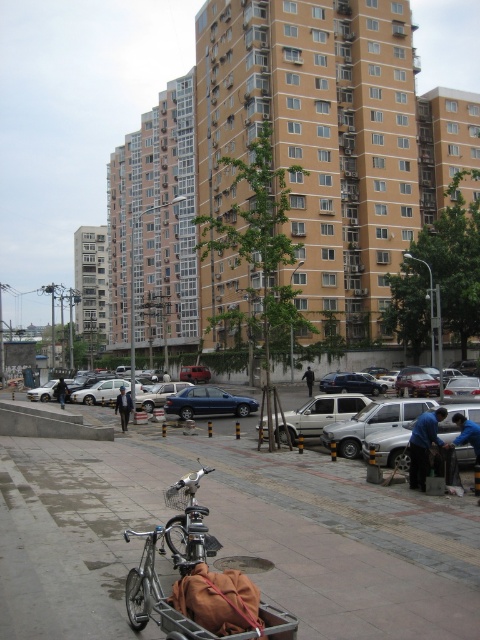
You are standing in front of the residential building and want to know which of the two points, point (146, 577) or point (239, 401), is closer to you. Based on the scene description, can you determine which point is nearer?

Point (146, 577) is closer to the viewer than point (239, 401).

You are a delivery person who needs to move the blue fabric jacket at lower right out of the way to access the sidewalk. However, you must ensure that the silver metallic bicycle at lower left remains in its current position. Can you move the jacket without moving the bicycle?

Yes, since the silver metallic bicycle at lower left is to the left of the blue fabric jacket at lower right, you can move the jacket to the right away from the bicycle while keeping the bicycle in place.

You are standing on the sidewalk in front of the residential building and see the silver metallic bicycle at lower left and the blue fabric jacket at lower right. Which object is closer to you?

The silver metallic bicycle at lower left is closer to you because it is positioned over the blue fabric jacket at lower right.